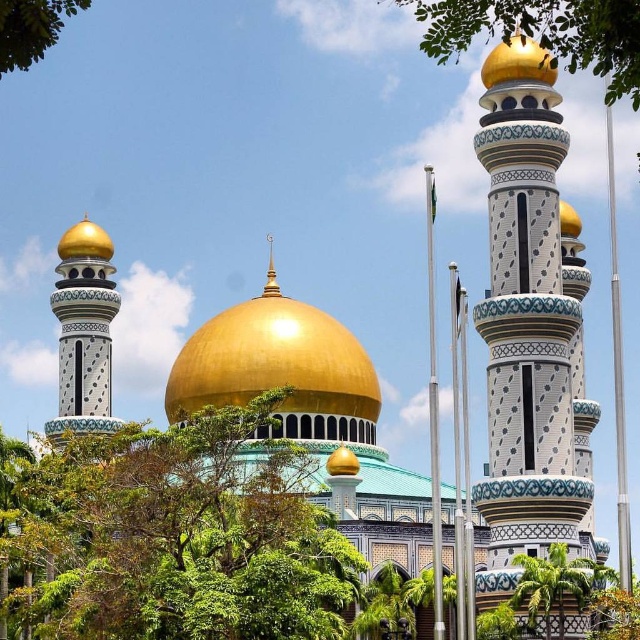
Is point (371, 400) behind point (428, 20)?

No, it is in front of (428, 20).

Locate an element on the screen. The width and height of the screenshot is (640, 640). gold shiny dome at center is located at coordinates (276, 364).

The image size is (640, 640). Describe the element at coordinates (544, 33) in the screenshot. I see `green leafy tree at upper center` at that location.

Is green leafy tree at upper center positioned at the back of green leafy tree at lower right?

That is False.

Where is `green leafy tree at upper center`? green leafy tree at upper center is located at coordinates (544, 33).

Who is more distant from viewer, [580,481] or [566,557]?

Point [580,481]

Is point (522, 332) positioned in front of point (540, 589)?

No.

You are a GUI agent. You are given a task and a screenshot of the screen. Output one action in this format:
    pyautogui.click(x=<x>, y=<y>)
    Task: Click on the white mosaic tower at right
    
    Given the screenshot: What is the action you would take?
    pyautogui.click(x=531, y=326)